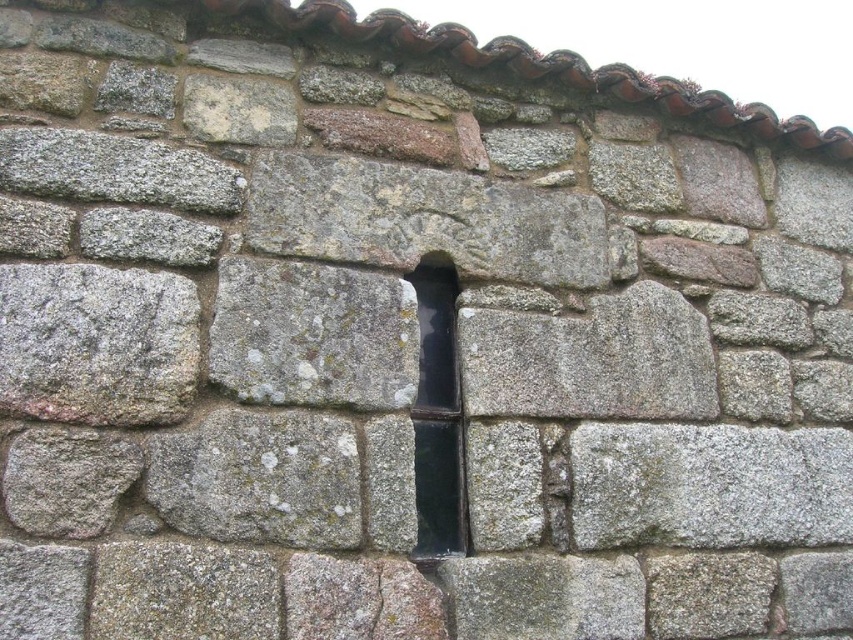
You are an architect examining the stone wall. You notice the black glass window at center and the gray stone crack at center. Which of these two features is taller?

The black glass window at center is much taller than the gray stone crack at center.